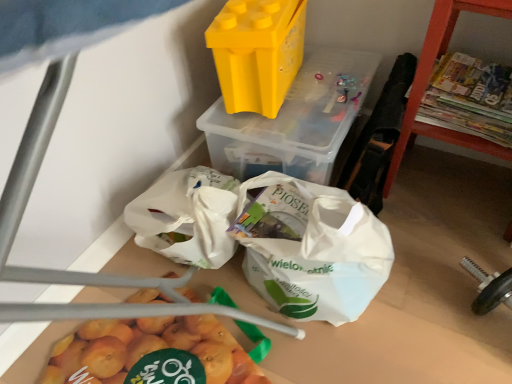
Question: Should I look upward or downward to see orange wood shelf at right?

Choices:
 (A) down
 (B) up

Answer: (B)

Question: Considering the relative sizes of orange wood shelf at right and yellow plastic container at upper center, marked as the first yoghurt in a left-to-right arrangement, in the image provided, is orange wood shelf at right thinner than yellow plastic container at upper center, marked as the first yoghurt in a left-to-right arrangement,?

Choices:
 (A) yes
 (B) no

Answer: (B)

Question: Is the depth of orange wood shelf at right greater than that of yellow plastic container at upper center, marked as the first yoghurt in a left-to-right arrangement?

Choices:
 (A) no
 (B) yes

Answer: (A)

Question: Is yellow plastic container at upper center, marked as the first yoghurt in a left-to-right arrangement, a part of orange wood shelf at right?

Choices:
 (A) yes
 (B) no

Answer: (B)

Question: Is orange wood shelf at right not within yellow plastic container at upper center, acting as the second yoghurt starting from the right?

Choices:
 (A) yes
 (B) no

Answer: (A)

Question: Does orange wood shelf at right have a larger size compared to yellow plastic container at upper center, acting as the second yoghurt starting from the right?

Choices:
 (A) yes
 (B) no

Answer: (A)

Question: From the image's perspective, would you say orange wood shelf at right is shown under yellow plastic container at upper center, marked as the first yoghurt in a left-to-right arrangement?

Choices:
 (A) yes
 (B) no

Answer: (A)

Question: Is yellow plastic container at upper center, marked as the first yoghurt in a left-to-right arrangement, further to camera compared to orange wood shelf at right?

Choices:
 (A) yes
 (B) no

Answer: (A)

Question: From a real-world perspective, is yellow plastic container at upper center, marked as the first yoghurt in a left-to-right arrangement, physically above orange wood shelf at right?

Choices:
 (A) no
 (B) yes

Answer: (B)

Question: Considering the relative sizes of yellow plastic container at upper center, marked as the first yoghurt in a left-to-right arrangement, and orange wood shelf at right in the image provided, is yellow plastic container at upper center, marked as the first yoghurt in a left-to-right arrangement, bigger than orange wood shelf at right?

Choices:
 (A) no
 (B) yes

Answer: (A)

Question: Considering the relative sizes of yellow plastic container at upper center, marked as the first yoghurt in a left-to-right arrangement, and orange wood shelf at right in the image provided, is yellow plastic container at upper center, marked as the first yoghurt in a left-to-right arrangement, smaller than orange wood shelf at right?

Choices:
 (A) yes
 (B) no

Answer: (A)

Question: Considering the relative positions of yellow plastic container at upper center, acting as the second yoghurt starting from the right, and orange wood shelf at right in the image provided, is yellow plastic container at upper center, acting as the second yoghurt starting from the right, to the right of orange wood shelf at right from the viewer's perspective?

Choices:
 (A) yes
 (B) no

Answer: (B)

Question: From the image's perspective, does yellow plastic container at upper center, acting as the second yoghurt starting from the right, appear lower than orange wood shelf at right?

Choices:
 (A) yes
 (B) no

Answer: (B)

Question: Is yellow plastic container at upper center, the second yoghurt in the left-to-right sequence, smaller than orange wood shelf at right?

Choices:
 (A) yes
 (B) no

Answer: (A)